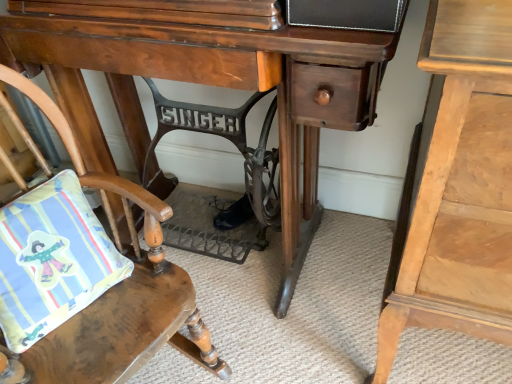
This screenshot has width=512, height=384. What are the coordinates of `vacant space that's between light wood nightstand at right and wooden desk at center` in the screenshot? It's located at (280, 333).